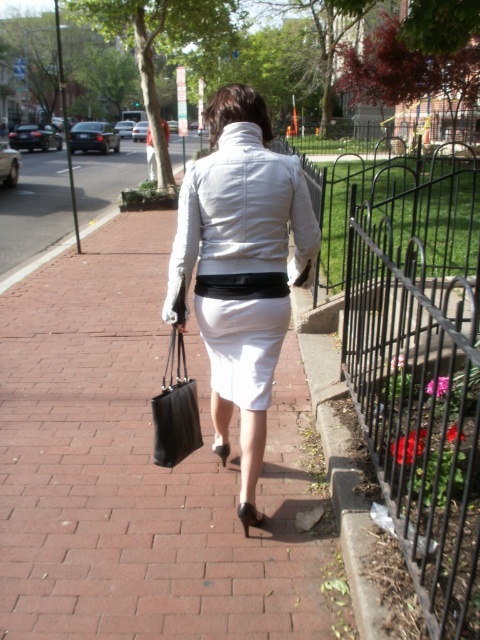
Question: Is white matte skirt at center bigger than black leather bag at center?

Choices:
 (A) no
 (B) yes

Answer: (B)

Question: Which of the following is the closest to the observer?

Choices:
 (A) (229, 394)
 (B) (176, 433)
 (C) (210, 340)

Answer: (B)

Question: Considering the relative positions of white cotton pencil skirt at center and black leather bag at center in the image provided, where is white cotton pencil skirt at center located with respect to black leather bag at center?

Choices:
 (A) right
 (B) left

Answer: (A)

Question: Which of the following is the farthest from the observer?

Choices:
 (A) black leather bag at center
 (B) white cotton pencil skirt at center
 (C) white matte skirt at center

Answer: (A)

Question: Which of the following is the farthest from the observer?

Choices:
 (A) black leather bag at center
 (B) white cotton pencil skirt at center
 (C) white matte skirt at center

Answer: (A)

Question: Does white matte skirt at center have a lesser width compared to black leather bag at center?

Choices:
 (A) yes
 (B) no

Answer: (B)